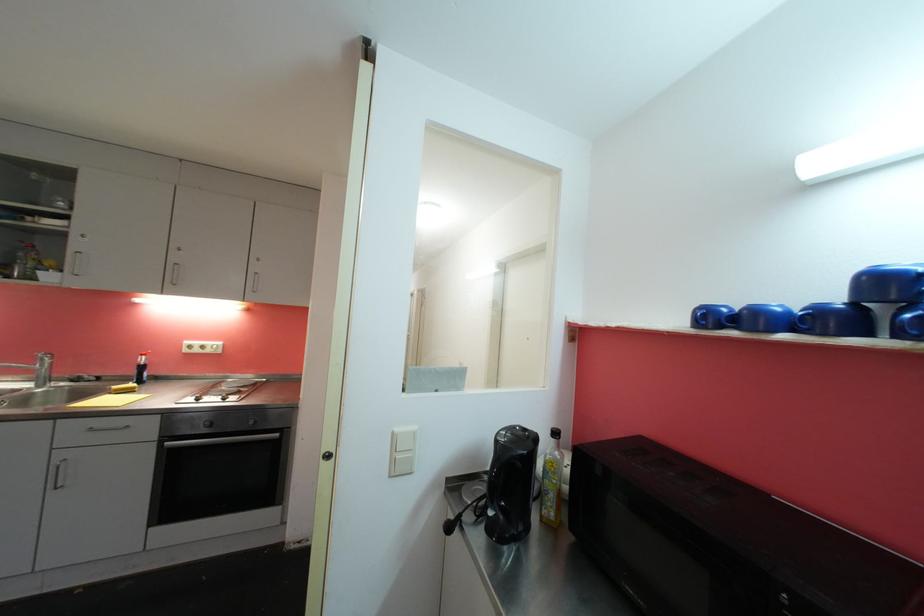
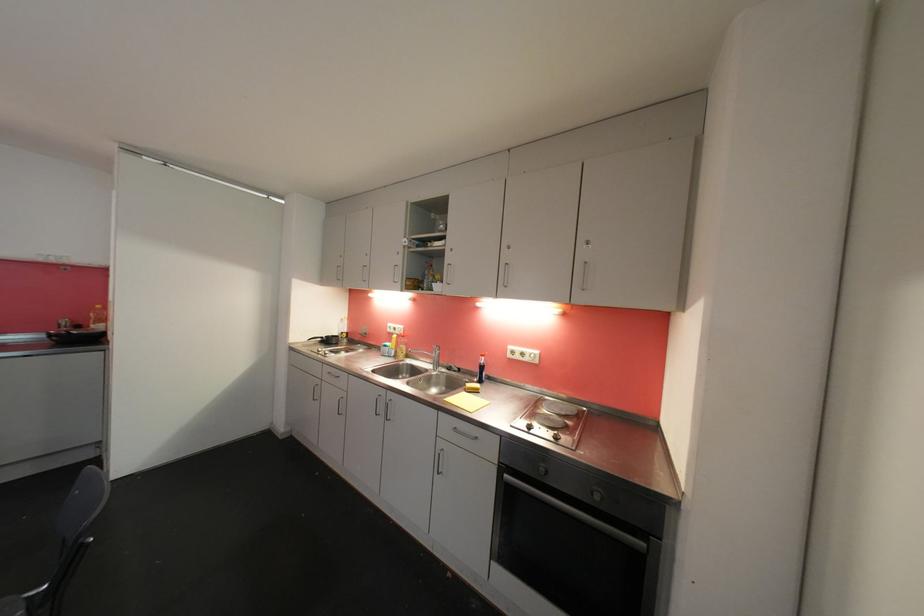
The point at (122, 389) is marked in the first image. Where is the corresponding point in the second image?

(473, 387)